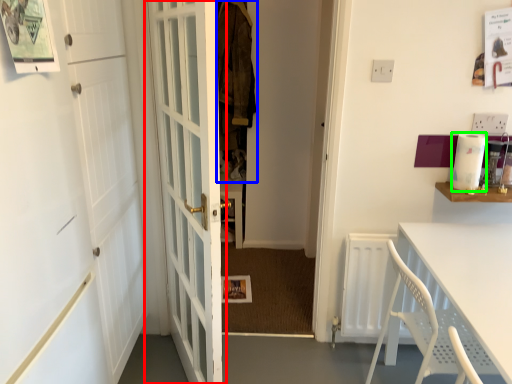
Question: Considering the real-world distances, which object is farthest from door (highlighted by a red box)? laundry (highlighted by a blue box) or appliance (highlighted by a green box)?

Choices:
 (A) laundry
 (B) appliance

Answer: (B)